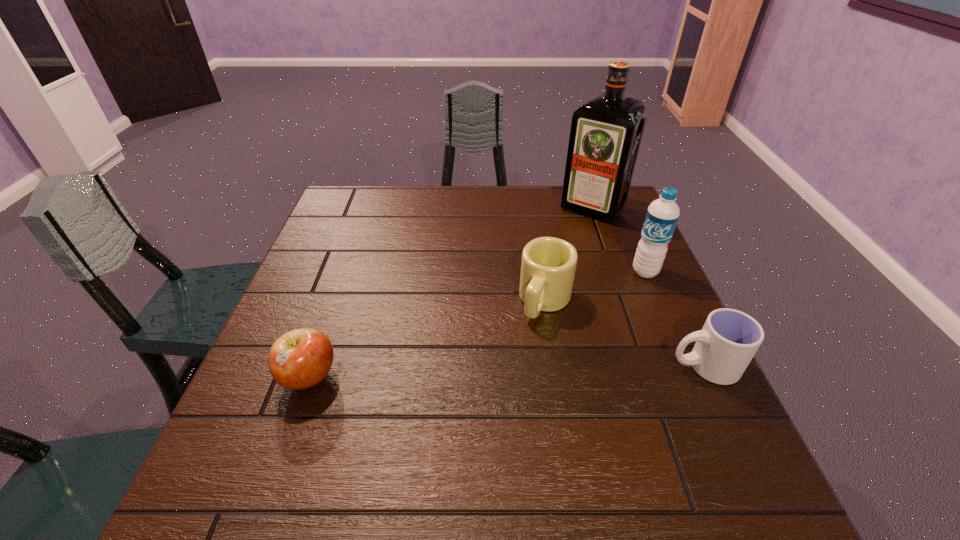
Find the location of a particular element. blank space located 0.180m with the handle on the side of the fourth object from right to left is located at coordinates (508, 384).

Locate an element on the screen. vacant space located with the handle on the side of the fourth object from right to left is located at coordinates (477, 444).

Locate an element on the screen. Image resolution: width=960 pixels, height=540 pixels. free space located with the handle on the side of the fourth object from right to left is located at coordinates coord(518,363).

The height and width of the screenshot is (540, 960). Identify the location of free space located 0.090m on the label of the second tallest object. (617, 294).

Where is `vacant space located on the label of the second tallest object`? The width and height of the screenshot is (960, 540). vacant space located on the label of the second tallest object is located at coordinates (592, 314).

I want to click on vacant space located 0.260m on the label of the second tallest object, so click(573, 329).

You are a GUI agent. You are given a task and a screenshot of the screen. Output one action in this format:
    pyautogui.click(x=<x>, y=<y>)
    Task: Click on the vacant space located on the front label of the tallest object
    
    Given the screenshot: What is the action you would take?
    pyautogui.click(x=544, y=266)

This screenshot has height=540, width=960. Find the location of `free location located 0.180m on the front label of the tallest object`. free location located 0.180m on the front label of the tallest object is located at coordinates (x=554, y=254).

The width and height of the screenshot is (960, 540). In order to click on vacant space located 0.140m on the front label of the tallest object in this screenshot , I will do `click(560, 246)`.

Locate an element on the screen. This screenshot has height=540, width=960. object at the far edge is located at coordinates (606, 131).